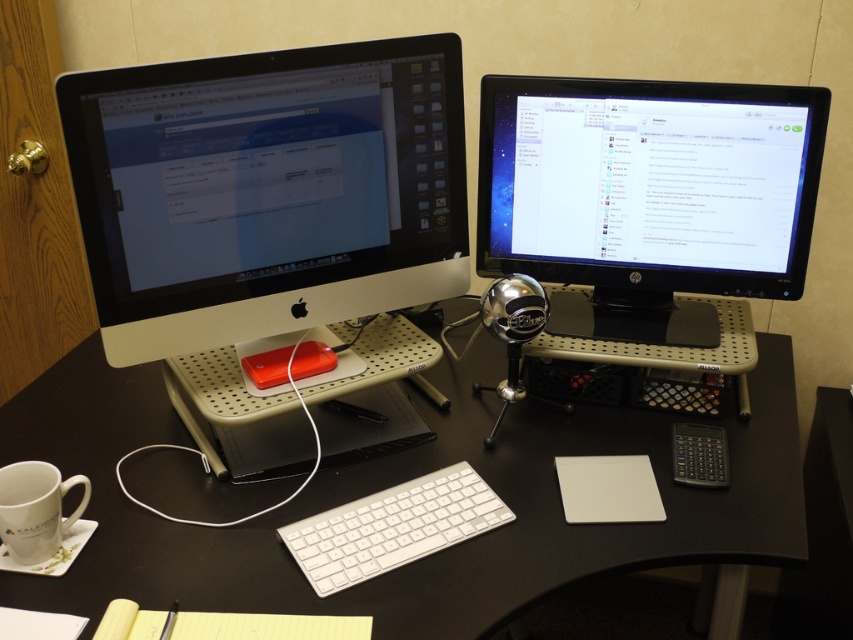
Is point (158, 253) farther from viewer compared to point (505, 624)?

Yes.

Can you confirm if white glossy desktop computer at left is wider than black plastic computer desk at center?

No.

Locate an element on the screen. white glossy desktop computer at left is located at coordinates (264, 202).

Find the location of a particular element. Image resolution: width=853 pixels, height=640 pixels. white glossy desktop computer at left is located at coordinates (264, 202).

In the scene shown: Does black plastic computer desk at center appear under white plastic keyboard at center?

No.

Is black plastic computer desk at center shorter than white plastic keyboard at center?

No.

Who is more distant from viewer, (x=780, y=339) or (x=469, y=490)?

The point (x=780, y=339) is behind.

Identify the location of black plastic computer desk at center. This screenshot has width=853, height=640. (401, 481).

How far apart are black plastic computer desk at center and white ceramic mug at lower left?

They are 15.15 inches apart.

Looking at this image, can you confirm if black plastic computer desk at center is shorter than white ceramic mug at lower left?

In fact, black plastic computer desk at center may be taller than white ceramic mug at lower left.

Where is `black plastic computer desk at center`? This screenshot has height=640, width=853. black plastic computer desk at center is located at coordinates (401, 481).

I want to click on black plastic computer desk at center, so click(x=401, y=481).